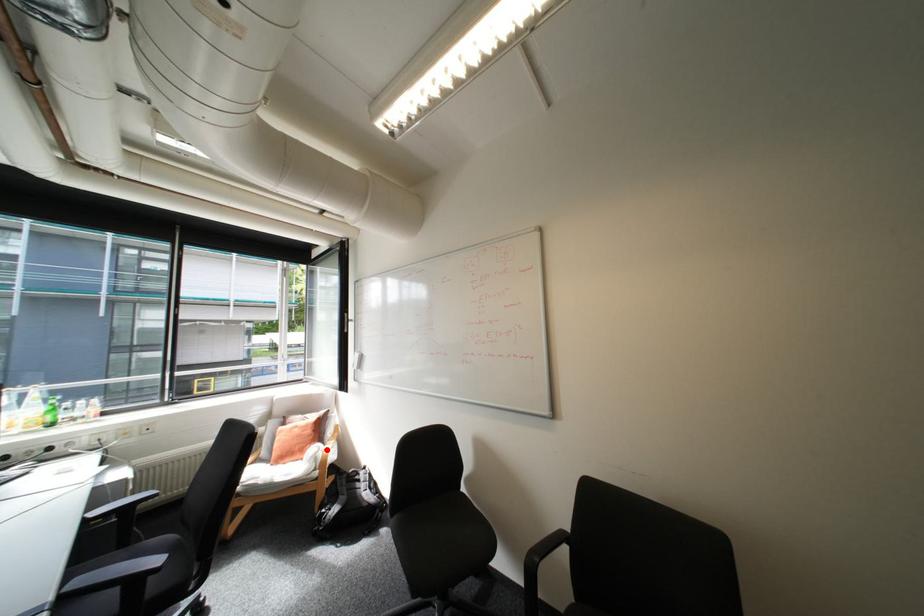
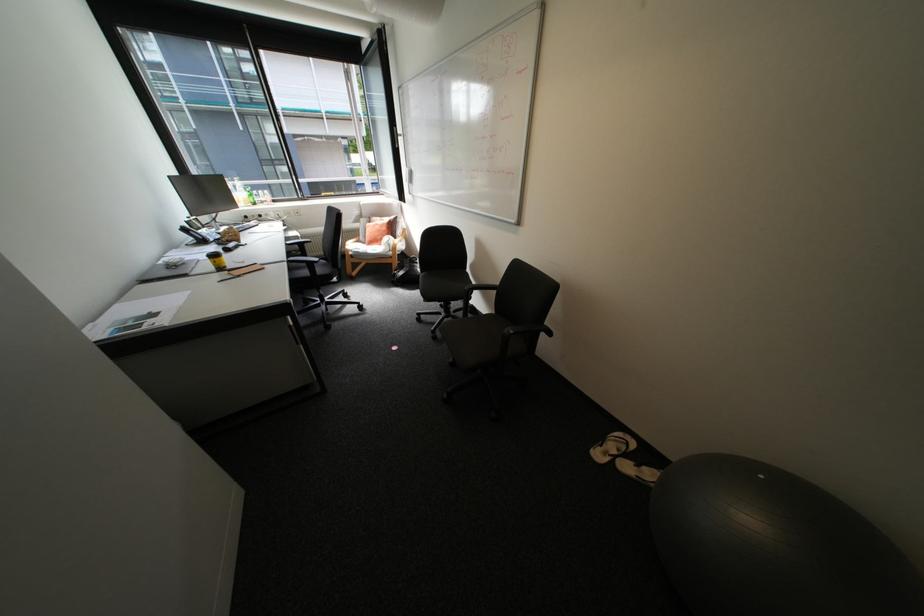
Question: I am providing you with two images of the same scene from different viewpoints. In image1, a red point is highlighted. Considering the same 3D point in image2, which of the following is correct?

Choices:
 (A) It is closer
 (B) It is farther

Answer: (A)